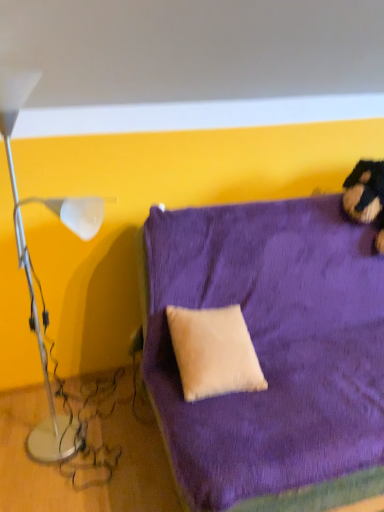
Question: Should I look upward or downward to see beige suede pillow at center?

Choices:
 (A) down
 (B) up

Answer: (A)

Question: Considering the relative positions of white glossy lamp at left and velvet purple couch at center in the image provided, is white glossy lamp at left to the left of velvet purple couch at center from the viewer's perspective?

Choices:
 (A) no
 (B) yes

Answer: (B)

Question: From a real-world perspective, is white glossy lamp at left located higher than velvet purple couch at center?

Choices:
 (A) no
 (B) yes

Answer: (B)

Question: Is white glossy lamp at left smaller than velvet purple couch at center?

Choices:
 (A) no
 (B) yes

Answer: (B)

Question: Is white glossy lamp at left looking in the opposite direction of velvet purple couch at center?

Choices:
 (A) no
 (B) yes

Answer: (A)

Question: Is white glossy lamp at left far away from velvet purple couch at center?

Choices:
 (A) no
 (B) yes

Answer: (A)

Question: Is the position of white glossy lamp at left less distant than that of velvet purple couch at center?

Choices:
 (A) no
 (B) yes

Answer: (B)

Question: Does velvet purple couch at center have a smaller size compared to white glossy lamp at left?

Choices:
 (A) yes
 (B) no

Answer: (B)

Question: Does velvet purple couch at center touch white glossy lamp at left?

Choices:
 (A) yes
 (B) no

Answer: (B)

Question: From a real-world perspective, is velvet purple couch at center under white glossy lamp at left?

Choices:
 (A) no
 (B) yes

Answer: (B)

Question: Can you confirm if velvet purple couch at center is shorter than white glossy lamp at left?

Choices:
 (A) no
 (B) yes

Answer: (B)

Question: Considering the relative sizes of velvet purple couch at center and white glossy lamp at left in the image provided, is velvet purple couch at center wider than white glossy lamp at left?

Choices:
 (A) no
 (B) yes

Answer: (B)

Question: Is velvet purple couch at center positioned before white glossy lamp at left?

Choices:
 (A) no
 (B) yes

Answer: (A)

Question: Is beige suede pillow at center at the back of white glossy lamp at left?

Choices:
 (A) no
 (B) yes

Answer: (A)